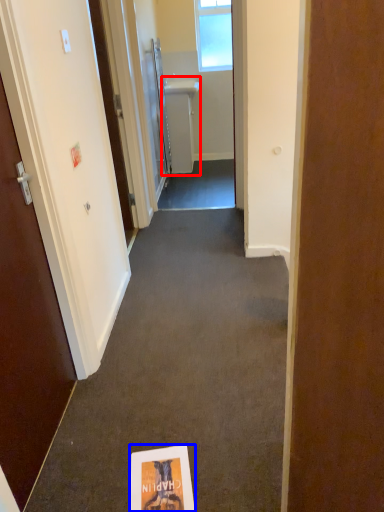
Question: Which object is closer to the camera taking this photo, sink (highlighted by a red box) or flyer (highlighted by a blue box)?

Choices:
 (A) sink
 (B) flyer

Answer: (B)